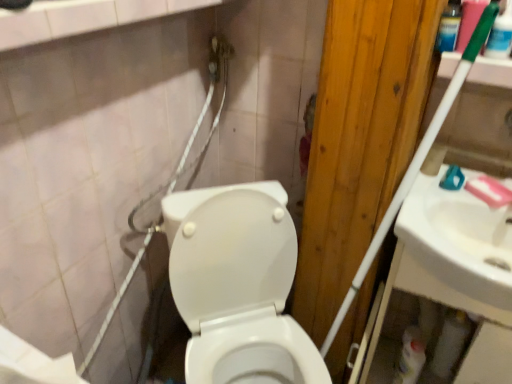
Question: Considering their positions, is white glossy sink at right located in front of or behind pink matte soap at upper right?

Choices:
 (A) behind
 (B) front

Answer: (B)

Question: Is white glossy sink at right wider or thinner than pink matte soap at upper right?

Choices:
 (A) wide
 (B) thin

Answer: (A)

Question: Which object is positioned farthest from the white matte toilet paper at lower left, placed as the 1th toilet paper when sorted from left to right?

Choices:
 (A) white matte toilet paper at lower right, which is counted as the 1th toilet paper, starting from the back
 (B) white glossy toilet at center
 (C) white glossy bottle at lower right
 (D) clear plastic bottle at upper right
 (E) white glossy sink at right

Answer: (A)

Question: Which is farther from the white matte toilet paper at lower left, positioned as the first toilet paper in top-to-bottom order?

Choices:
 (A) pink matte soap at upper right
 (B) white glossy bottle at lower right
 (C) clear plastic bottle at upper right
 (D) white matte toilet paper at lower right, which appears as the first toilet paper when ordered from the bottom
 (E) white glossy sink at right

Answer: (D)